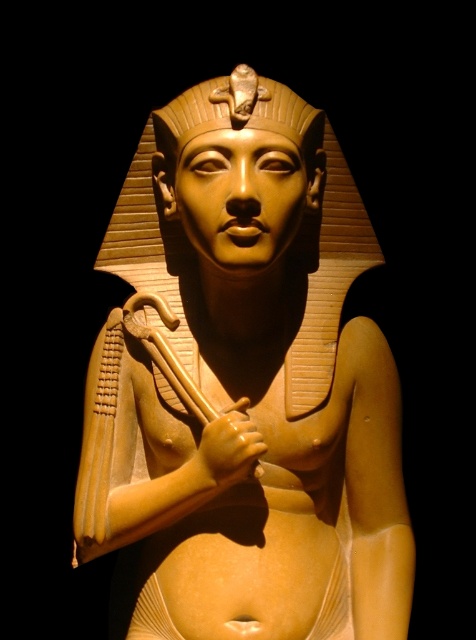
You are an archaeologist examining the statue and head in the scene. Which object is closer to you, the matte gold statue at center or the matte gold pharaoh head at center?

The matte gold statue at center is closer to you because it is in front of the matte gold pharaoh head at center.

You are an archaeologist examining the statue from a specific viewpoint. You notice two points marked on the statue. The first point is at coordinates point (x=150, y=147) and the second is at point (x=188, y=138). Based on your observation, which point is closer to you?

Point (x=188, y=138) is closer to you because the description states that point (x=150, y=147) is behind point (x=188, y=138).

You are an art conservator examining the statue. You need to place a protective barrier around both the matte gold statue at center and the matte gold pharaoh head at center. Since the statue is larger, where should you position the barrier relative to the pharaoh head?

The matte gold statue at center is positioned on the left side of the matte gold pharaoh head at center, so you should place the barrier to the left of the pharaoh head to accommodate the statue.